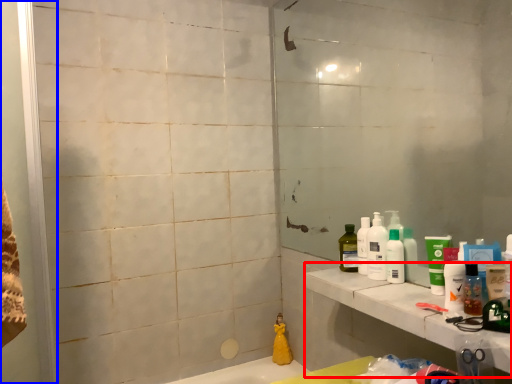
Question: Which point is closer to the camera, counter top (highlighted by a red box) or screen door (highlighted by a blue box)?

Choices:
 (A) counter top
 (B) screen door

Answer: (B)